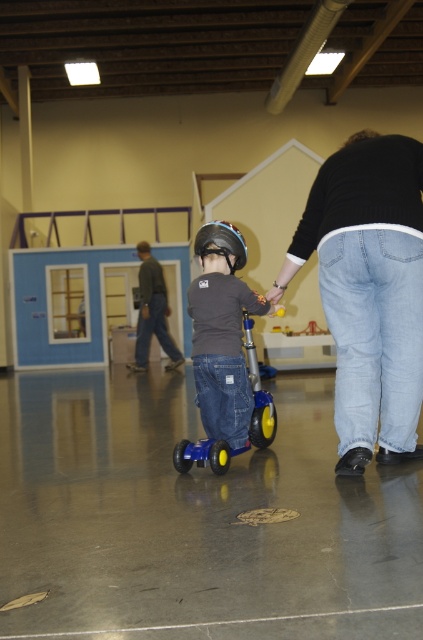
You are a safety inspector checking the distance between the jeans at center and the black matte helmet at center. According to safety regulations, the minimum safe distance between a child and an adult while riding a scooter should be at least 1.2 meters. Is the current distance compliant with the regulation?

The distance between the jeans at center and the black matte helmet at center is 1.04 meters, which is less than the required 1.2 meters. Therefore, it does not comply with the safety regulation.

You are a photographer setting up a shoot in this space. You need to ensure that the jeans at center and the matte black helmet at center are both visible in the frame. Given their sizes, which object should you focus on to ensure both are in focus?

The jeans at center is much taller than the matte black helmet at center, so focusing on the jeans at center would ensure both are in focus since it is the larger object.